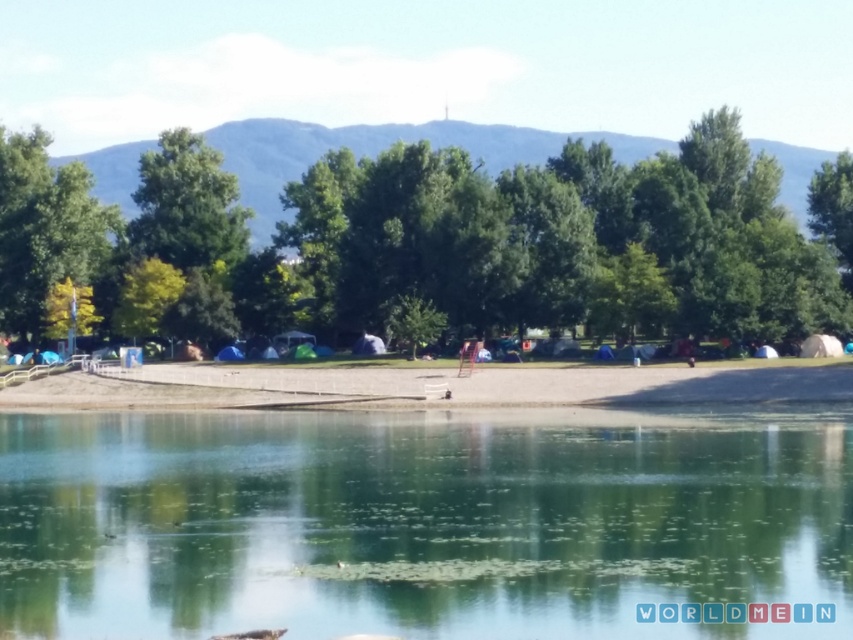
Question: Is brown sand at center positioned before green leafy tree at left?

Choices:
 (A) yes
 (B) no

Answer: (A)

Question: Which is nearer to the green leafy tree at center?

Choices:
 (A) green leafy tree at left
 (B) brown sand at center
 (C) clear water at center

Answer: (B)

Question: Which object appears closest to the camera in this image?

Choices:
 (A) green leafy tree at left
 (B) clear water at center
 (C) green leafy tree at center

Answer: (B)

Question: Considering the real-world distances, which object is closest to the brown sand at center?

Choices:
 (A) green leafy tree at left
 (B) green leafy tree at center
 (C) clear water at center

Answer: (B)

Question: Can you confirm if clear water at center is positioned to the left of brown sand at center?

Choices:
 (A) yes
 (B) no

Answer: (B)

Question: Observing the image, what is the correct spatial positioning of brown sand at center in reference to green leafy tree at left?

Choices:
 (A) left
 (B) right

Answer: (B)